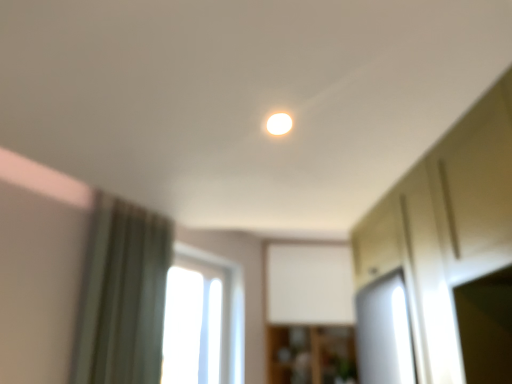
Question: Based on their positions, is wooden cabinet at center located to the left or right of matte white light at center?

Choices:
 (A) left
 (B) right

Answer: (B)

Question: Is wooden cabinet at center wider or thinner than matte white light at center?

Choices:
 (A) thin
 (B) wide

Answer: (B)

Question: Considering the real-world distances, which object is farthest from the transparent glass window at center?

Choices:
 (A) green fabric curtain at left
 (B) wooden cabinet at center
 (C) matte white light at center

Answer: (C)

Question: Estimate the real-world distances between objects in this image. Which object is farther from the transparent glass window at center?

Choices:
 (A) wooden cabinet at center
 (B) matte white light at center
 (C) green fabric curtain at left

Answer: (B)